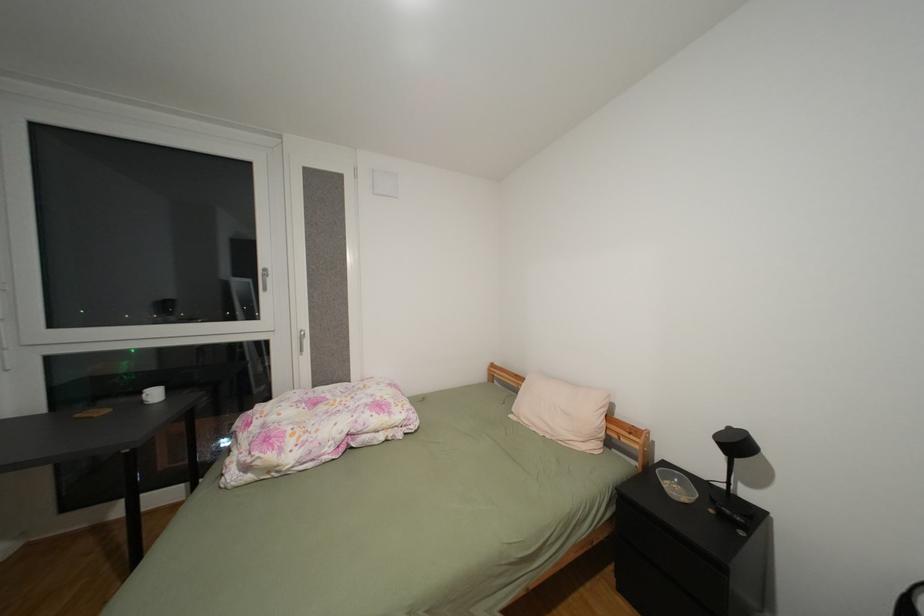
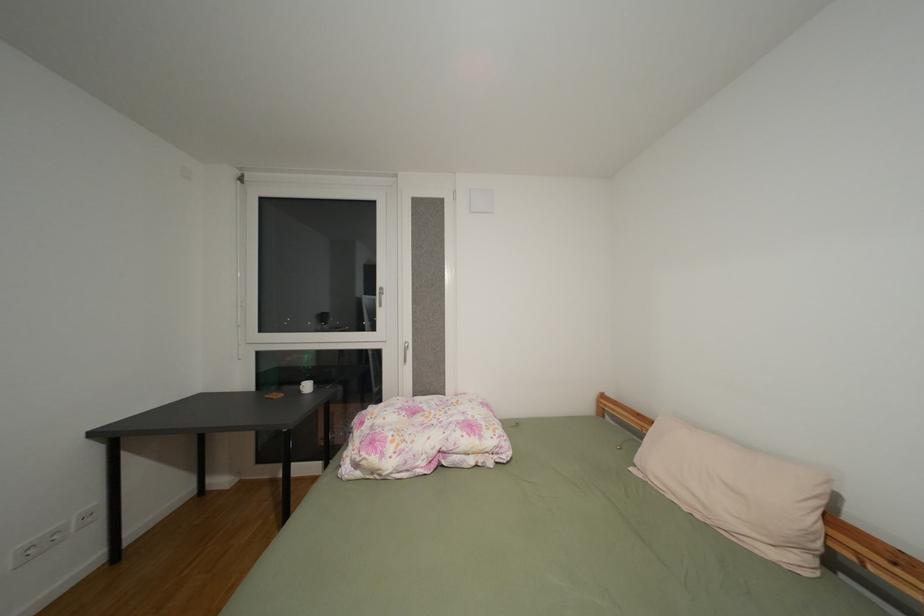
Question: The camera is either moving clockwise (left) or counter-clockwise (right) around the object. The first image is from the beginning of the video and the second image is from the end. Is the camera moving left or right when shooting the video?

Choices:
 (A) Left
 (B) Right

Answer: (B)